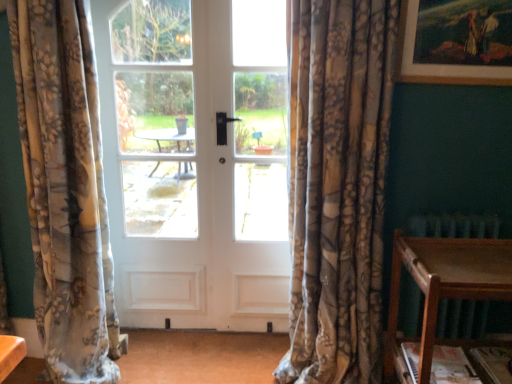
Question: Does white matte door at center have a greater width compared to floral fabric curtain at left, the 1th curtain viewed from the left?

Choices:
 (A) yes
 (B) no

Answer: (B)

Question: Is white matte door at center positioned behind floral fabric curtain at left, the second curtain from the right?

Choices:
 (A) yes
 (B) no

Answer: (A)

Question: Is white matte door at center shorter than floral fabric curtain at left, the second curtain from the right?

Choices:
 (A) no
 (B) yes

Answer: (A)

Question: Is white matte door at center oriented away from floral fabric curtain at left, the second curtain from the right?

Choices:
 (A) no
 (B) yes

Answer: (A)

Question: Does white matte door at center have a smaller size compared to floral fabric curtain at left, the 1th curtain viewed from the left?

Choices:
 (A) no
 (B) yes

Answer: (B)

Question: Based on their positions, is wooden table at lower right located to the left or right of white matte door at center?

Choices:
 (A) right
 (B) left

Answer: (A)

Question: From a real-world perspective, is wooden table at lower right positioned above or below white matte door at center?

Choices:
 (A) below
 (B) above

Answer: (A)

Question: Is wooden table at lower right situated inside white matte door at center or outside?

Choices:
 (A) outside
 (B) inside

Answer: (A)

Question: Based on their sizes in the image, would you say wooden table at lower right is bigger or smaller than white matte door at center?

Choices:
 (A) big
 (B) small

Answer: (A)

Question: Considering their positions, is wooden table at lower right located in front of or behind wooden picture frame at upper right?

Choices:
 (A) front
 (B) behind

Answer: (A)

Question: From their relative heights in the image, would you say wooden table at lower right is taller or shorter than wooden picture frame at upper right?

Choices:
 (A) tall
 (B) short

Answer: (A)

Question: Looking at the image, does wooden table at lower right seem bigger or smaller compared to wooden picture frame at upper right?

Choices:
 (A) small
 (B) big

Answer: (B)

Question: Is wooden table at lower right to the left or to the right of wooden picture frame at upper right in the image?

Choices:
 (A) left
 (B) right

Answer: (A)

Question: Is white matte door at center wider or thinner than wooden table at lower right?

Choices:
 (A) wide
 (B) thin

Answer: (B)

Question: In terms of size, does white matte door at center appear bigger or smaller than wooden table at lower right?

Choices:
 (A) big
 (B) small

Answer: (B)